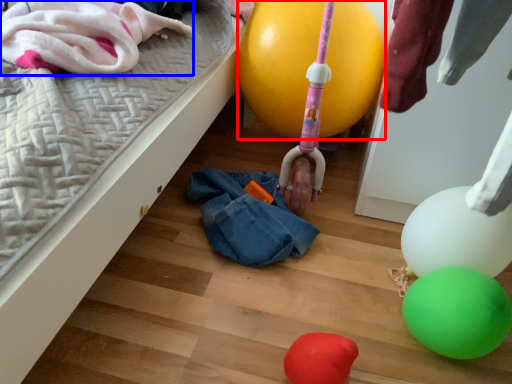
Question: Among these objects, which one is farthest to the camera, balloon (highlighted by a red box) or clothing (highlighted by a blue box)?

Choices:
 (A) balloon
 (B) clothing

Answer: (A)